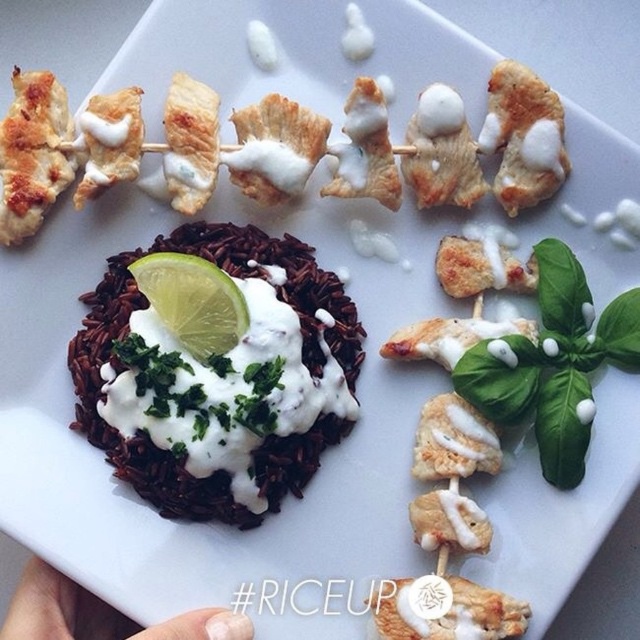
Question: Can you confirm if green matte lime at center is positioned to the left of white creamy chicken skewer at center?

Choices:
 (A) no
 (B) yes

Answer: (B)

Question: Where is green leafy basil at lower right located in relation to white matte plate at upper center in the image?

Choices:
 (A) below
 (B) above

Answer: (B)

Question: Which of the following is the farthest from the observer?

Choices:
 (A) (372, 611)
 (B) (550, 180)
 (C) (198, 316)

Answer: (B)

Question: Can you confirm if green leafy basil at lower right is bigger than white creamy chicken skewer at center?

Choices:
 (A) no
 (B) yes

Answer: (B)

Question: Among these objects, which one is farthest from the camera?

Choices:
 (A) golden-brown crispy chicken at upper right
 (B) green matte lime at center
 (C) dark brown rice at center

Answer: (A)

Question: Which object is positioned closest to the golden-brown crispy chicken at upper right?

Choices:
 (A) white matte plate at upper center
 (B) green leafy basil at lower right

Answer: (B)